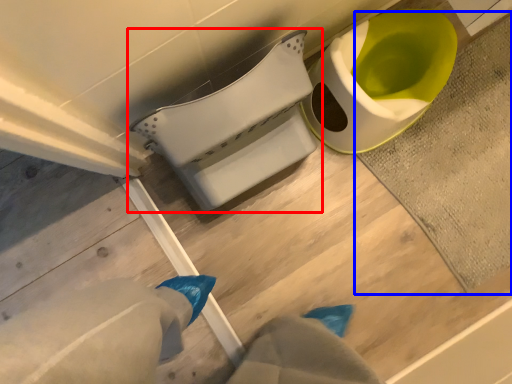
Question: Which object is closer to the camera taking this photo, toilet (highlighted by a red box) or bath mat (highlighted by a blue box)?

Choices:
 (A) toilet
 (B) bath mat

Answer: (A)